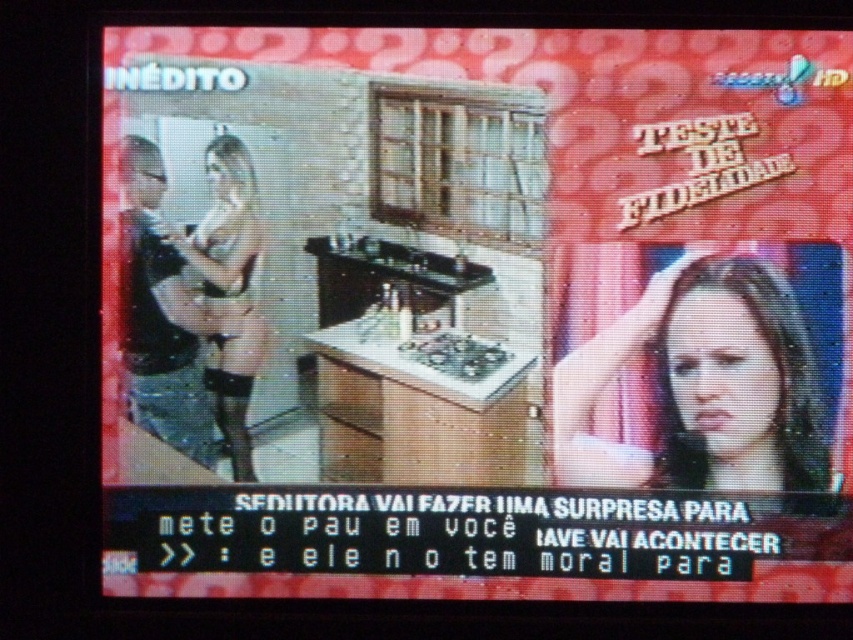
Which is below, smooth brown hair at right or matte black lingerie at left?

smooth brown hair at right is lower down.

Which is in front, point (752, 276) or point (244, 204)?

Point (752, 276) is more forward.

Find the location of a particular element. Image resolution: width=853 pixels, height=640 pixels. smooth brown hair at right is located at coordinates (703, 385).